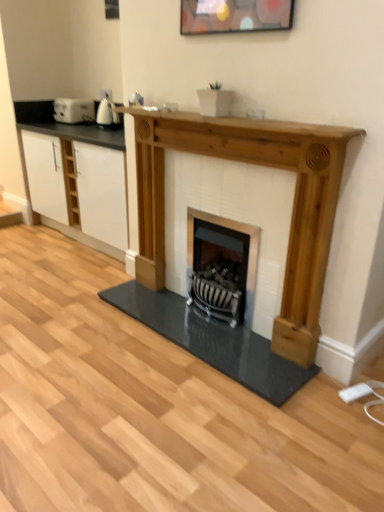
Where is `free space in front of natural wood fireplace at center`? free space in front of natural wood fireplace at center is located at coordinates (195, 418).